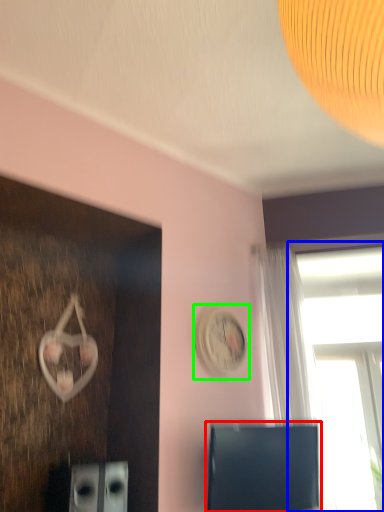
Question: Considering the real-world distances, which object is closest to computer monitor (highlighted by a red box)? window (highlighted by a blue box) or clock (highlighted by a green box).

Choices:
 (A) window
 (B) clock

Answer: (B)